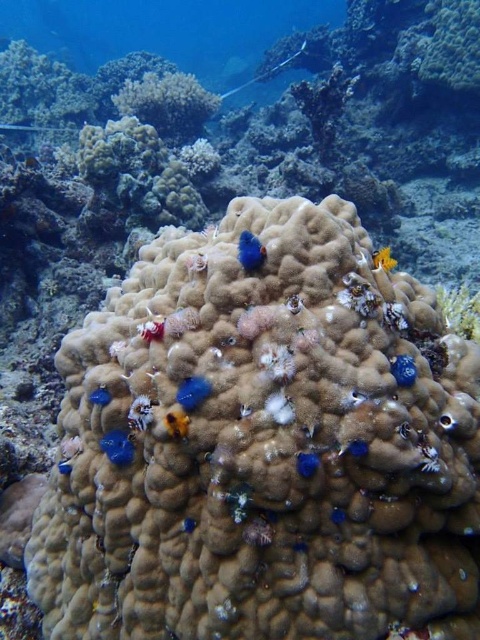
Question: Which is nearer to the smooth blue fish at center?

Choices:
 (A) blue matte coral at center
 (B) smooth yellow fish at center

Answer: (B)

Question: Can you confirm if blue rubber fish at lower left is bigger than matte blue coral at lower left?

Choices:
 (A) no
 (B) yes

Answer: (B)

Question: Which point is closer to the camera?

Choices:
 (A) (175, 417)
 (B) (112, 460)

Answer: (A)

Question: Does blue rubber fish at lower left appear over matte blue coral at lower left?

Choices:
 (A) yes
 (B) no

Answer: (B)

Question: Does blue matte coral at center appear over smooth yellow fish at center?

Choices:
 (A) no
 (B) yes

Answer: (B)

Question: Which object appears farthest from the camera in this image?

Choices:
 (A) blue matte coral at center
 (B) smooth yellow fish at center
 (C) yellow matte coral at upper right

Answer: (C)